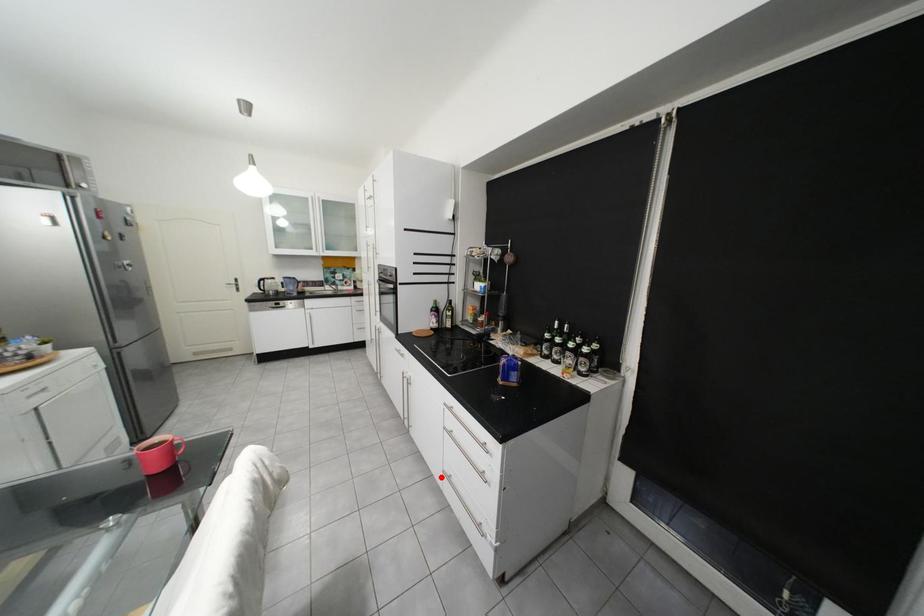
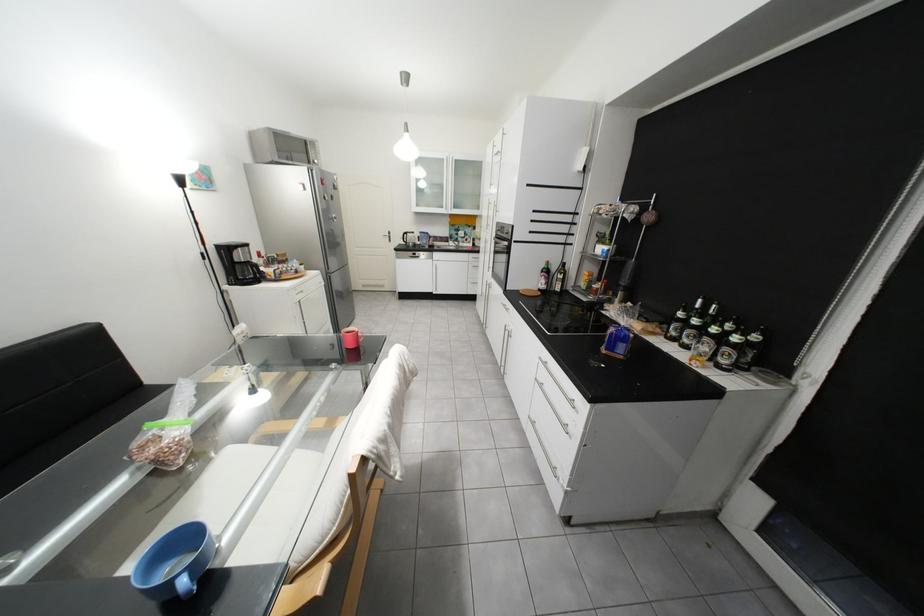
In the second image, find the point that corresponds to the highlighted location in the first image.

(528, 419)